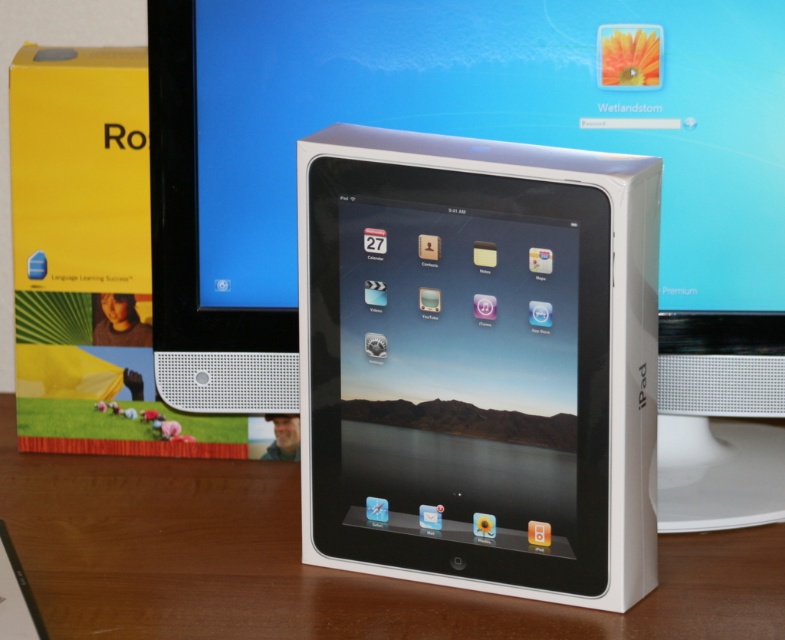
Between white glossy tablet at center and wooden table at center, which one appears on the right side from the viewer's perspective?

From the viewer's perspective, white glossy tablet at center appears more on the right side.

Is white glossy tablet at center below wooden table at center?

Incorrect, white glossy tablet at center is not positioned below wooden table at center.

You are a GUI agent. You are given a task and a screenshot of the screen. Output one action in this format:
    pyautogui.click(x=<x>, y=<y>)
    Task: Click on the white glossy tablet at center
    The height and width of the screenshot is (640, 785).
    Given the screenshot: What is the action you would take?
    pyautogui.click(x=477, y=362)